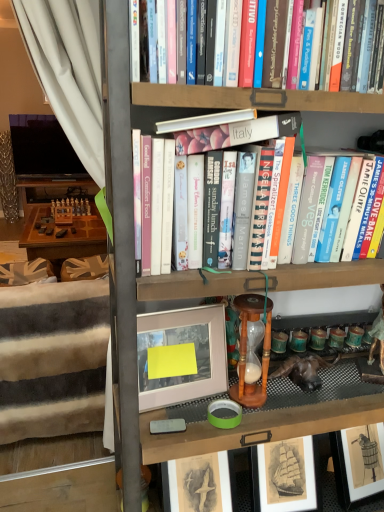
Question: Would you say white fabric bed frame at left is to the left or to the right of wooden hourglass at center in the picture?

Choices:
 (A) left
 (B) right

Answer: (A)

Question: In terms of width, does white fabric bed frame at left look wider or thinner when compared to wooden hourglass at center?

Choices:
 (A) thin
 (B) wide

Answer: (B)

Question: Which object is the closest to the hardcover books at center?

Choices:
 (A) white fabric bed frame at left
 (B) matte white picture frame at center
 (C) wooden bookcase at center
 (D) wooden hourglass at center

Answer: (D)

Question: Which is nearer to the wooden bookcase at center?

Choices:
 (A) wooden hourglass at center
 (B) hardcover books at center
 (C) matte white picture frame at center
 (D) white fabric bed frame at left

Answer: (C)